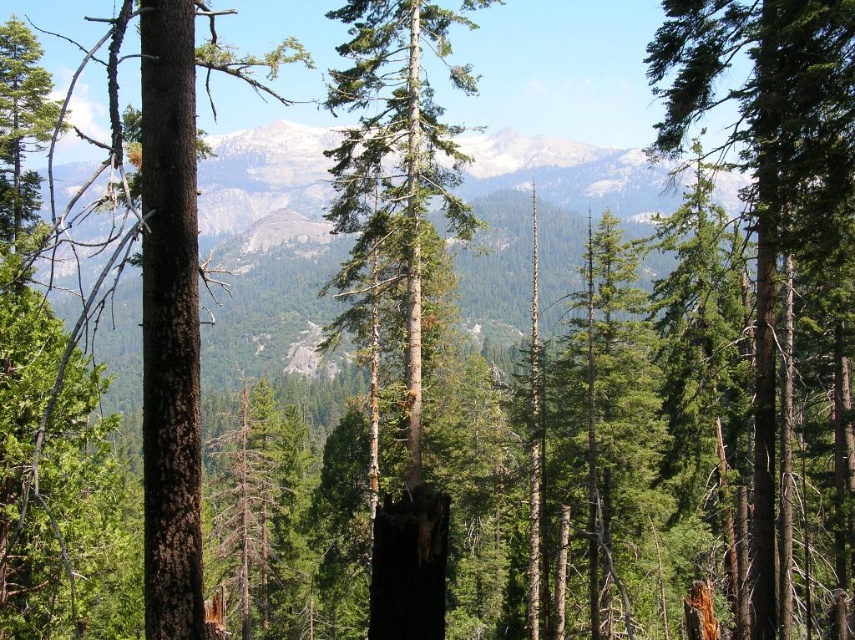
Question: Which object is farther from the camera taking this photo?

Choices:
 (A) green rough bark tree at center
 (B) green matte tree at right

Answer: (B)

Question: Does green rough bark tree at center have a lesser width compared to green matte tree at right?

Choices:
 (A) no
 (B) yes

Answer: (B)

Question: Among these objects, which one is nearest to the camera?

Choices:
 (A) green rough bark tree at center
 (B) green matte tree at right

Answer: (A)

Question: Can you confirm if green rough bark tree at center is thinner than green matte tree at right?

Choices:
 (A) no
 (B) yes

Answer: (B)

Question: Is green rough bark tree at center below green matte tree at right?

Choices:
 (A) yes
 (B) no

Answer: (B)